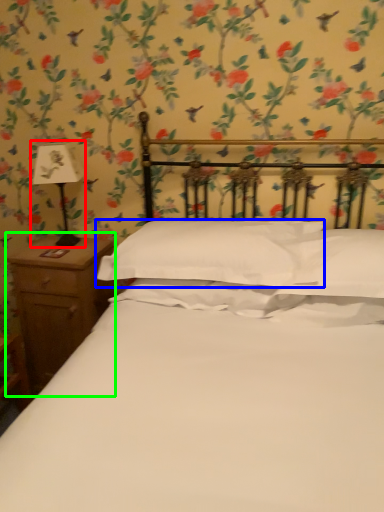
Question: Which is farther away from bedside lamp (highlighted by a red box)? pillow (highlighted by a blue box) or nightstand (highlighted by a green box)?

Choices:
 (A) pillow
 (B) nightstand

Answer: (A)